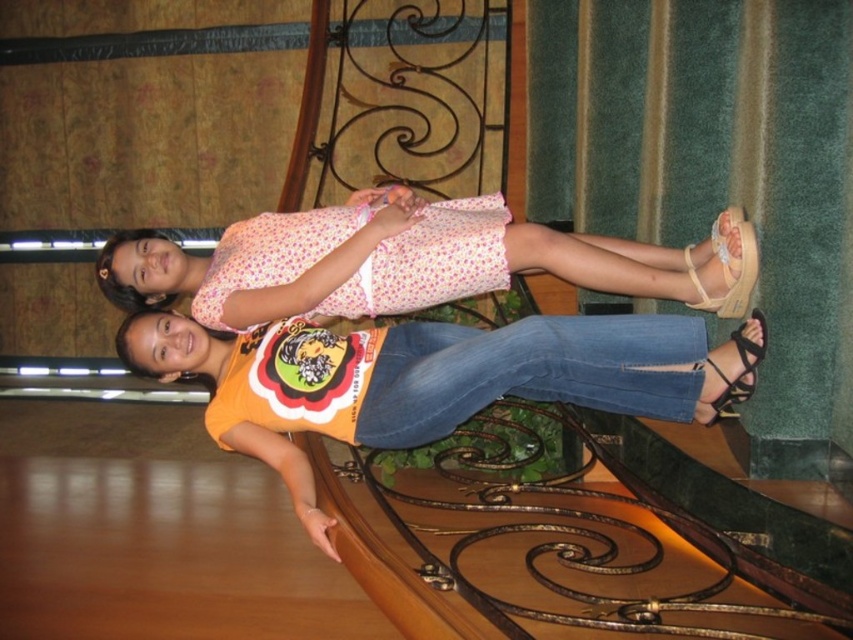
You are a photographer setting up a shoot in this location. You need to ensure that the pink floral dress at center and the black leather sandal at lower right are both visible in the frame. Based on their positions, which object will appear larger in the photo?

The pink floral dress at center is taller than the black leather sandal at lower right, so it will appear larger in the photo.

You are standing at the base of the staircase and want to reach the point marked as point (370, 284). Is this point closer to you or further away compared to point (740, 282)?

Point (370, 284) is closer to you than point (740, 282) because it is further to the viewer according to the description.